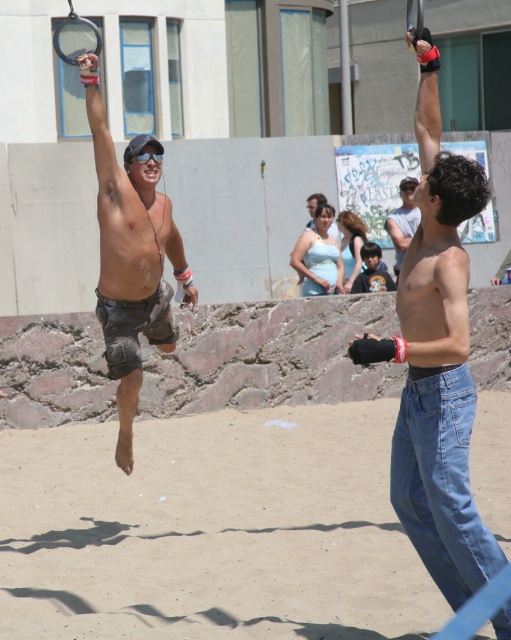
Does point (495, 630) lie behind point (129, 401)?

No.

Is denim jeans at center below matte black shorts at left?

Yes.

Describe the element at coordinates (436, 362) in the screenshot. The height and width of the screenshot is (640, 511). I see `denim jeans at center` at that location.

Where is `denim jeans at center`? denim jeans at center is located at coordinates (436, 362).

Which is more to the left, matte black shorts at left or denim shorts at center?

matte black shorts at left

Does point (134, 182) come closer to viewer compared to point (406, 211)?

That is True.

Which is behind, point (85, 92) or point (401, 182)?

The point (401, 182) is behind.

You are a GUI agent. You are given a task and a screenshot of the screen. Output one action in this format:
    pyautogui.click(x=<x>, y=<y>)
    Task: Click on the matte black shorts at left
    This screenshot has height=640, width=511.
    Given the screenshot: What is the action you would take?
    pyautogui.click(x=131, y=257)

Is sandy beach at lower center thinner than dark blue shirt at center?

No, sandy beach at lower center is not thinner than dark blue shirt at center.

Which is behind, point (64, 625) or point (364, 260)?

Point (364, 260)

Locate an element on the screen. The width and height of the screenshot is (511, 640). sandy beach at lower center is located at coordinates (212, 531).